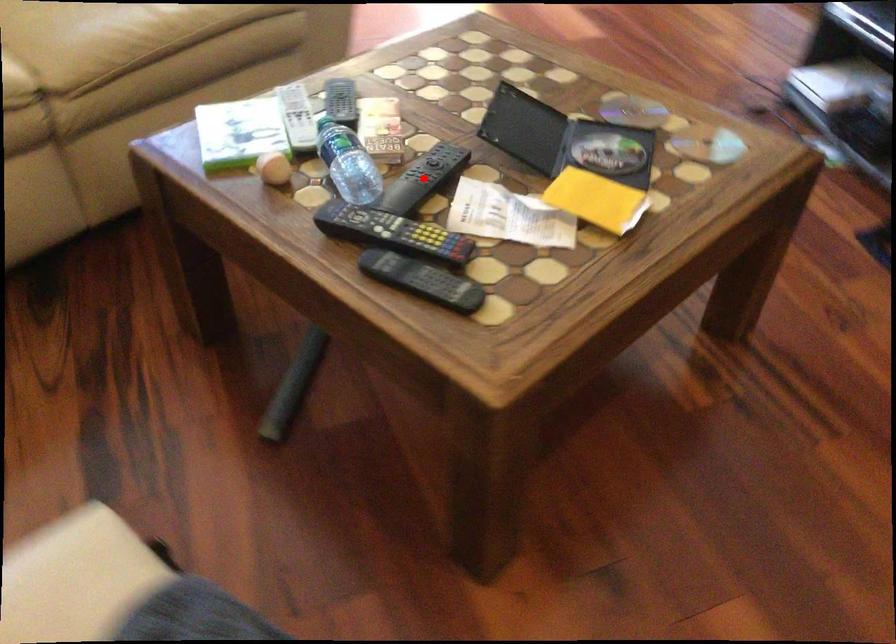
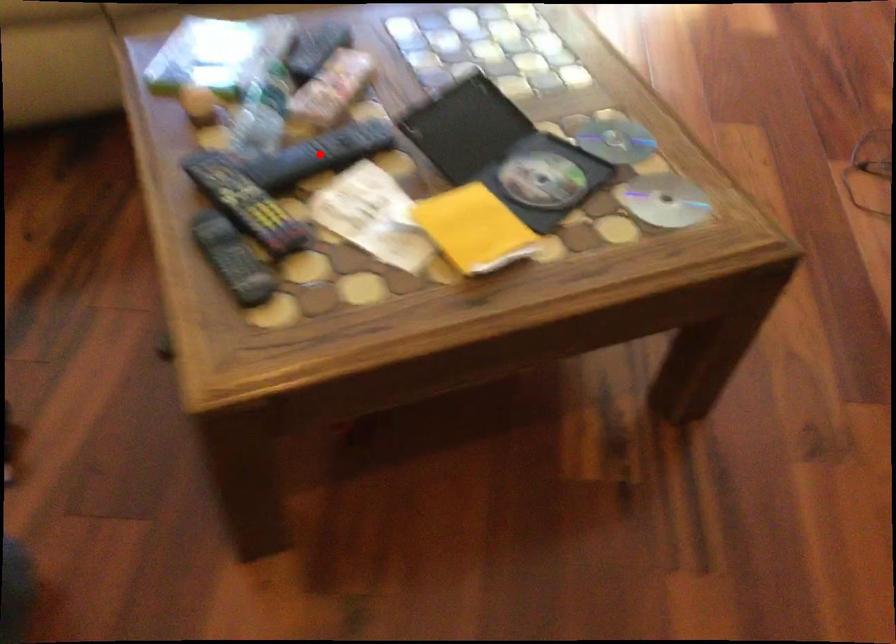
I am providing you with two images of the same scene from different viewpoints. A red point is marked on the first image and another point is marked on the second image. Does the point marked in image1 correspond to the same location as the one in image2?

Yes